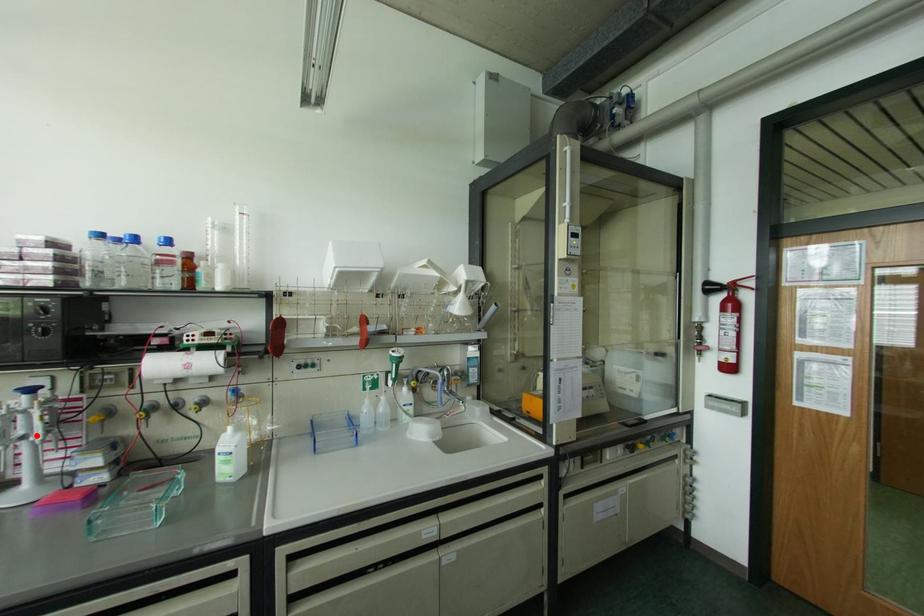
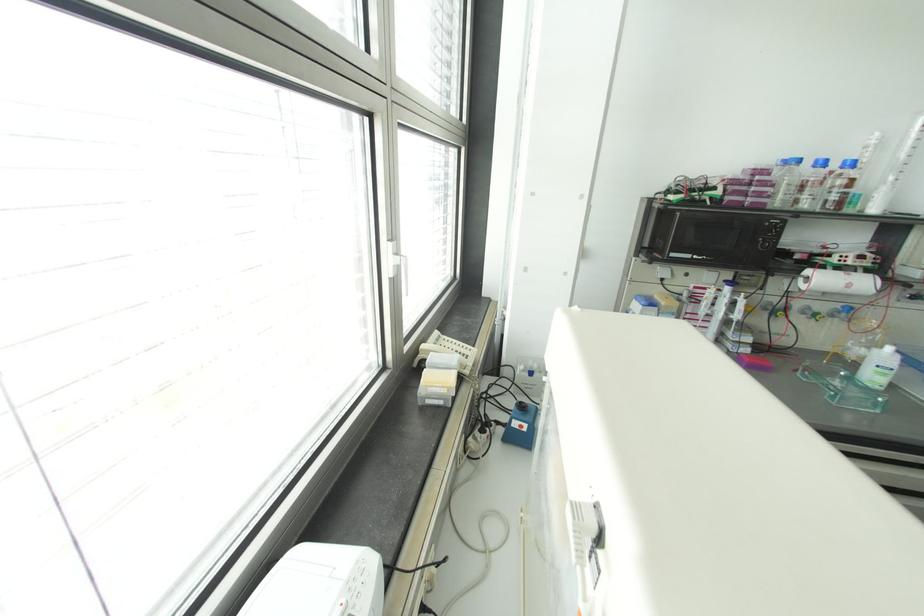
Where in the second image is the point corresponding to the highlighted location from the first image?

(736, 315)